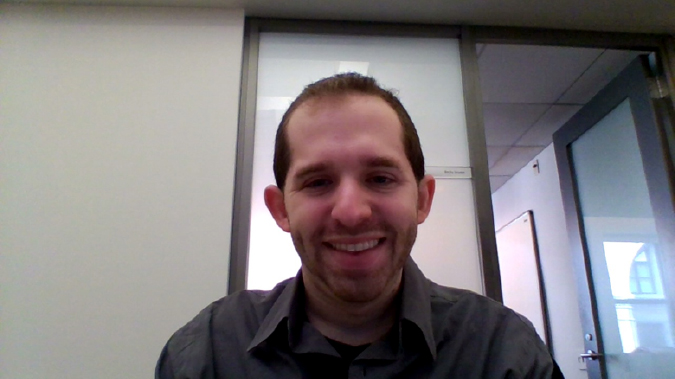
The width and height of the screenshot is (675, 379). I want to click on clouded glass, so click(410, 61).